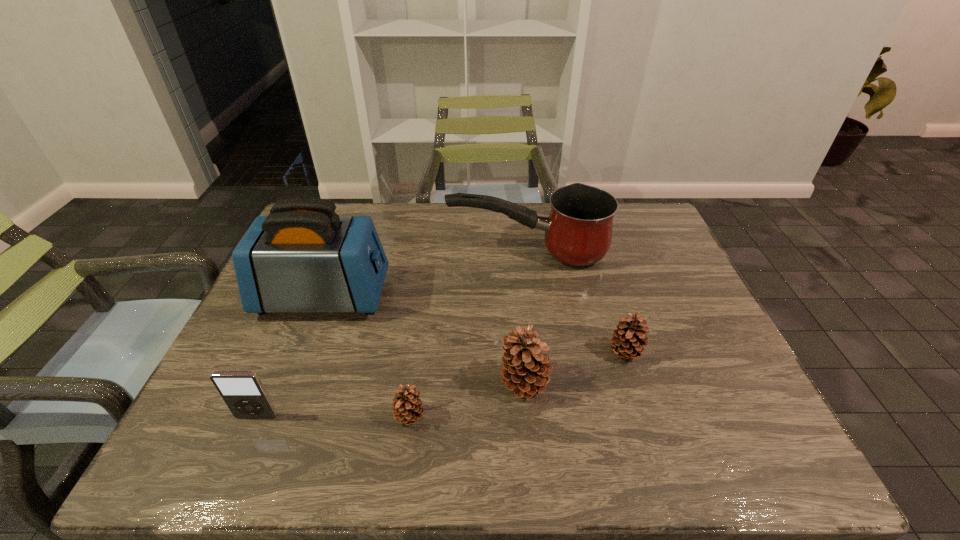
Where is `vacant space that's between the saucepan and the toaster`? The height and width of the screenshot is (540, 960). vacant space that's between the saucepan and the toaster is located at coordinates (425, 274).

Where is `vacant point located between the tallest object and the leftmost pinecone`? The image size is (960, 540). vacant point located between the tallest object and the leftmost pinecone is located at coordinates (367, 356).

Where is `vacant space that's between the second pinecone from left to right and the saucepan`? vacant space that's between the second pinecone from left to right and the saucepan is located at coordinates (526, 318).

Where is `free spot between the second pinecone from right to left and the rightmost pinecone`? The height and width of the screenshot is (540, 960). free spot between the second pinecone from right to left and the rightmost pinecone is located at coordinates (575, 368).

What are the coordinates of `object that stands as the fifth closest to the second shortest object` in the screenshot? It's located at (243, 392).

This screenshot has width=960, height=540. Find the location of `object that is the fifth nearest to the iPod`. object that is the fifth nearest to the iPod is located at coordinates (628, 339).

Locate which pinecone is the closest to the fifth tallest object. Please provide its 2D coordinates. Your answer should be formatted as a tuple, i.e. [(x, y)], where the tuple contains the x and y coordinates of a point satisfying the conditions above.

[(525, 370)]

Locate which pinecone is the second closest to the saucepan. Please provide its 2D coordinates. Your answer should be formatted as a tuple, i.e. [(x, y)], where the tuple contains the x and y coordinates of a point satisfying the conditions above.

[(525, 370)]

Identify the location of free spot that satisfies the following two spatial constraints: 1. on the front-facing side of the tallest object; 2. on the back side of the fifth tallest object. This screenshot has width=960, height=540. (302, 353).

Locate an element on the screen. Image resolution: width=960 pixels, height=540 pixels. free spot that satisfies the following two spatial constraints: 1. on the back side of the tallest pinecone; 2. on the front-facing side of the toaster is located at coordinates (516, 296).